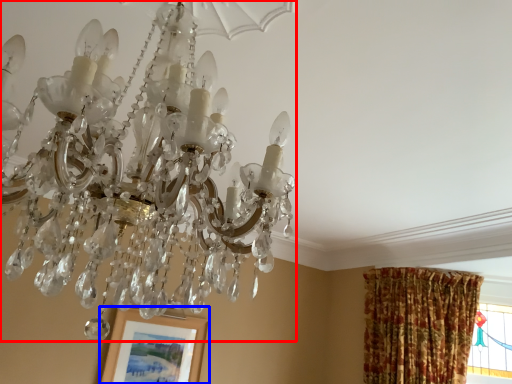
Question: Which of the following is the farthest to the observer, lamp (highlighted by a red box) or picture frame (highlighted by a blue box)?

Choices:
 (A) lamp
 (B) picture frame

Answer: (B)